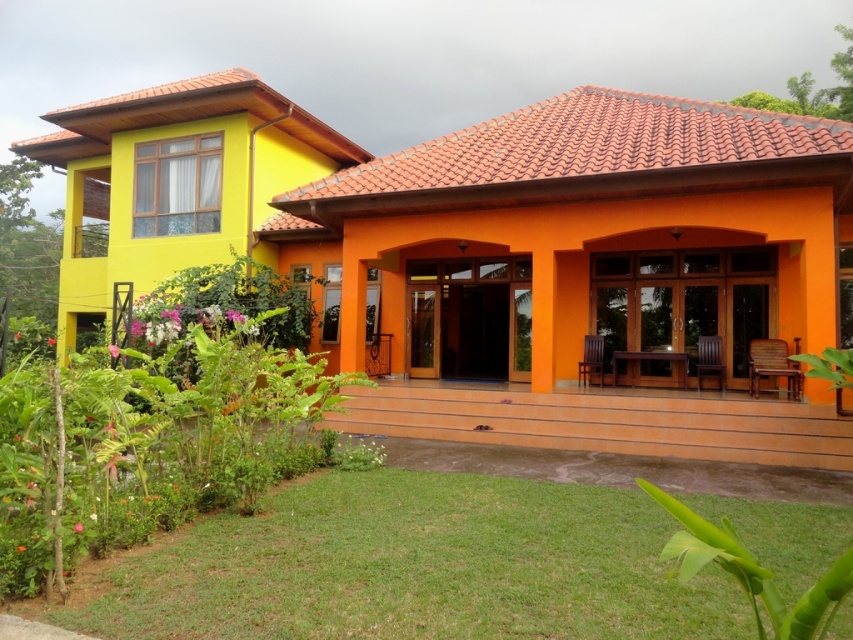
Does point (363, 516) come behind point (183, 396)?

No.

You are a GUI agent. You are given a task and a screenshot of the screen. Output one action in this format:
    pyautogui.click(x=<x>, y=<y>)
    Task: Click on the green grass at lower left
    This screenshot has height=640, width=853.
    Given the screenshot: What is the action you would take?
    pyautogui.click(x=410, y=566)

Where is `green grass at lower left`? green grass at lower left is located at coordinates (410, 566).